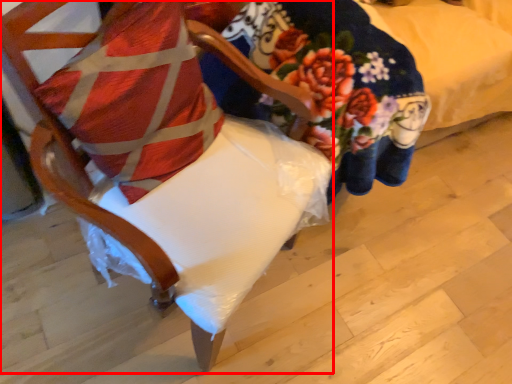
Question: In this image, where is chair (annotated by the red box) located relative to pillow?

Choices:
 (A) right
 (B) left

Answer: (A)